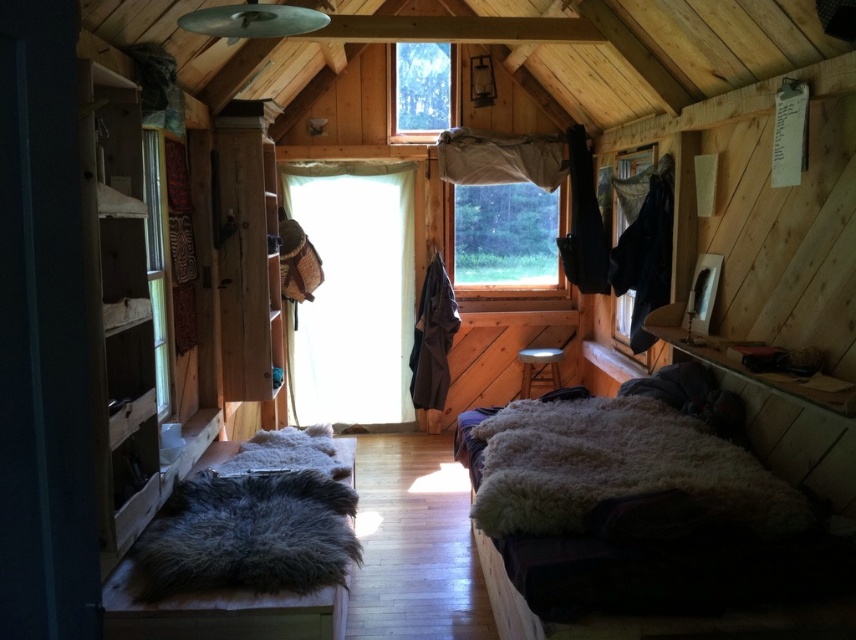
What do you see at coordinates (635, 513) in the screenshot?
I see `fuzzy woolen blanket at lower center` at bounding box center [635, 513].

Who is more distant from viewer, (562, 464) or (614, 308)?

The point (614, 308) is more distant.

Is point (810, 538) less distant than point (631, 172)?

Yes, it is in front of point (631, 172).

You are a GUI agent. You are given a task and a screenshot of the screen. Output one action in this format:
    pyautogui.click(x=<x>, y=<y>)
    Task: Click on the fuzzy woolen blanket at lower center
    Image resolution: width=856 pixels, height=640 pixels.
    Given the screenshot: What is the action you would take?
    pyautogui.click(x=635, y=513)

Does point (153, 352) come in front of point (620, 177)?

Yes, point (153, 352) is in front of point (620, 177).

Can you confirm if clear glass window at left is positioned to the right of transparent fabric at right?

Incorrect, clear glass window at left is not on the right side of transparent fabric at right.

Identify the location of clear glass window at left. This screenshot has width=856, height=640. (158, 266).

Does transparent glass window at upper center have a greater height compared to transparent fabric at right?

Indeed, transparent glass window at upper center has a greater height compared to transparent fabric at right.

This screenshot has height=640, width=856. What do you see at coordinates (419, 90) in the screenshot?
I see `transparent glass window at upper center` at bounding box center [419, 90].

At what (x,y) coordinates should I click in order to perform the action: click on transparent glass window at upper center. Please return your answer as a coordinate pair (x, y). Looking at the image, I should click on (419, 90).